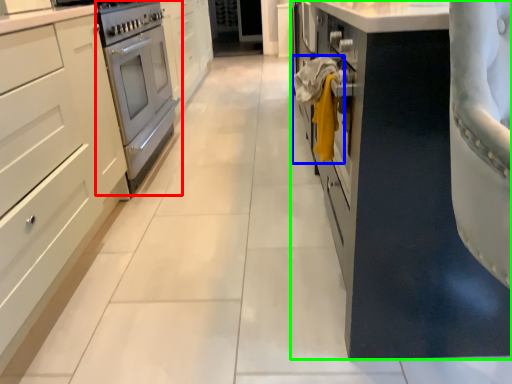
Question: Estimate the real-world distances between objects in this image. Which object is farther from home appliance (highlighted by a red box), laundry (highlighted by a blue box) or cabinetry (highlighted by a green box)?

Choices:
 (A) laundry
 (B) cabinetry

Answer: (B)